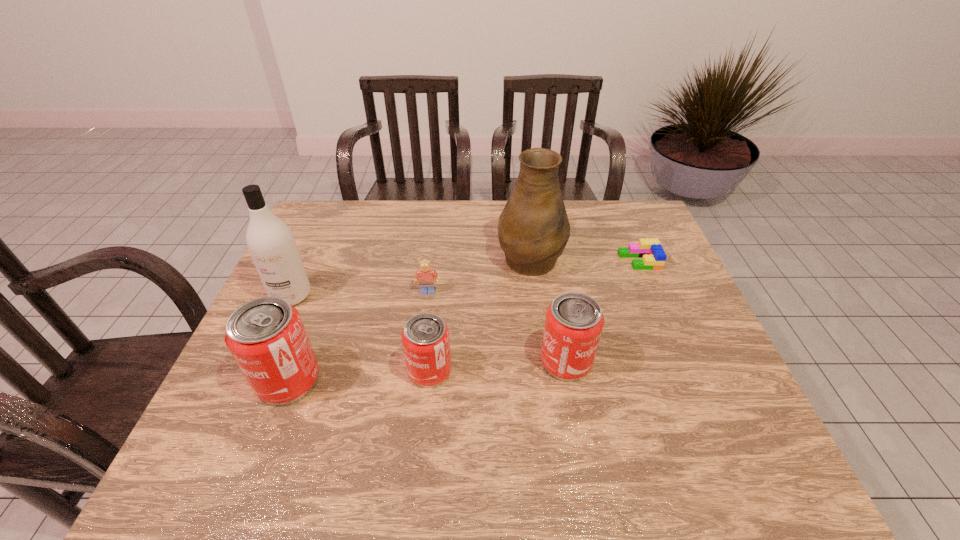
The width and height of the screenshot is (960, 540). Find the location of `can that is the closest one to the rightmost can`. can that is the closest one to the rightmost can is located at coordinates (425, 337).

The image size is (960, 540). In order to click on free space that satisfies the following two spatial constraints: 1. on the front-facing side of the shampoo; 2. on the right side of the second tallest can in this screenshot , I will do coord(261,361).

Where is `vacant region that satisfies the following two spatial constraints: 1. on the front-facing side of the shampoo; 2. on the right side of the second tallest can`? vacant region that satisfies the following two spatial constraints: 1. on the front-facing side of the shampoo; 2. on the right side of the second tallest can is located at coordinates (261, 361).

This screenshot has height=540, width=960. Find the location of `vacant space that satisfies the following two spatial constraints: 1. on the front-facing side of the sixth tallest object; 2. on the left side of the shortest can`. vacant space that satisfies the following two spatial constraints: 1. on the front-facing side of the sixth tallest object; 2. on the left side of the shortest can is located at coordinates (418, 370).